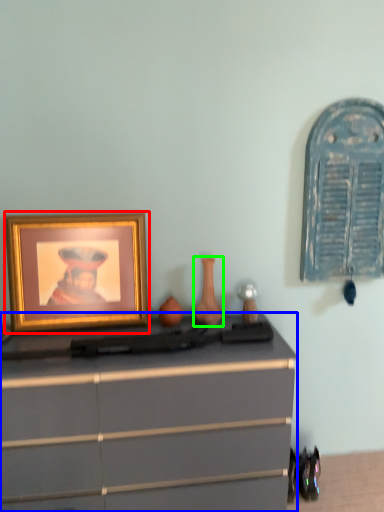
Question: Considering the real-world distances, which object is farthest from picture frame (highlighted by a red box)? chest of drawers (highlighted by a blue box) or vase (highlighted by a green box)?

Choices:
 (A) chest of drawers
 (B) vase

Answer: (B)